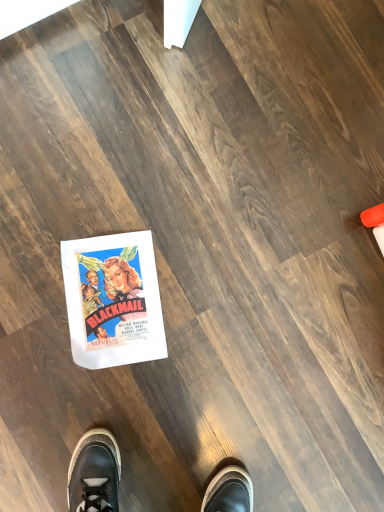
Where is `free space above white paper at center (from a real-world perspective)`? free space above white paper at center (from a real-world perspective) is located at coordinates (112, 300).